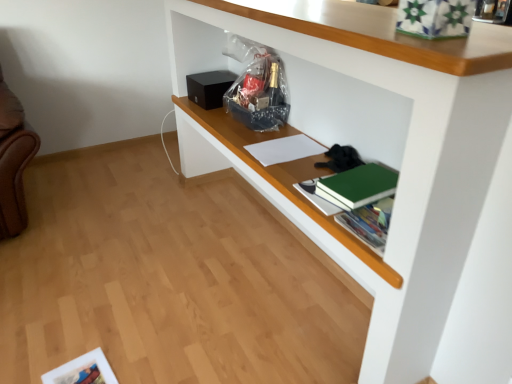
Find the location of `free space above green matte book at center-right (from a real-world perspective)`. free space above green matte book at center-right (from a real-world perspective) is located at coordinates (366, 175).